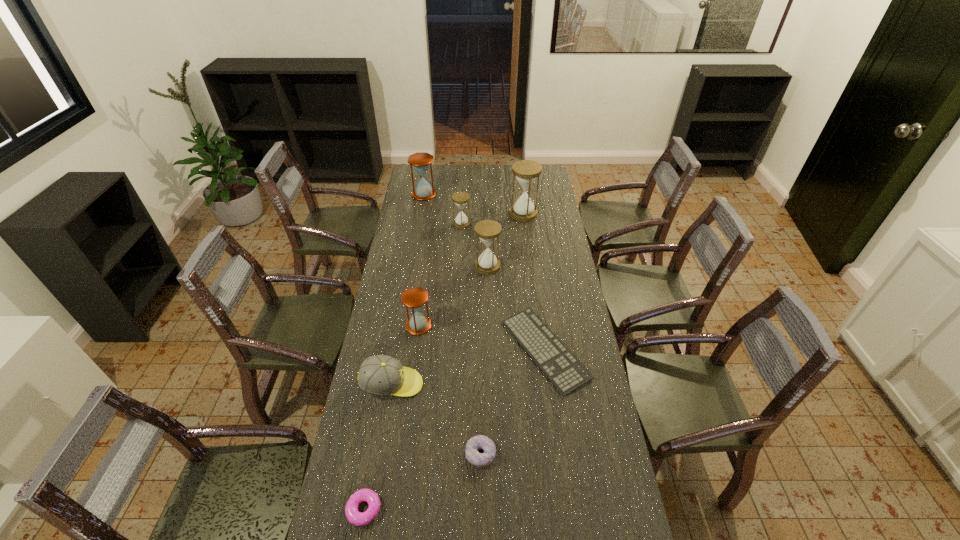
The image size is (960, 540). I want to click on vacant point located between the brown doughnut and the computer keyboard, so click(513, 402).

Where is `empty space that is in between the nearest hourglass and the second white hourglass from left to right`? This screenshot has width=960, height=540. empty space that is in between the nearest hourglass and the second white hourglass from left to right is located at coordinates (453, 296).

Where is `free space between the left doughnut and the smallest white hourglass`? The image size is (960, 540). free space between the left doughnut and the smallest white hourglass is located at coordinates [413, 367].

Locate an element on the screen. Image resolution: width=960 pixels, height=540 pixels. the third closest object to the tallest object is located at coordinates (423, 191).

Identify which object is located as the nearest to the third hourglass from right to left. Please provide its 2D coordinates. Your answer should be formatted as a tuple, i.e. [(x, y)], where the tuple contains the x and y coordinates of a point satisfying the conditions above.

[(423, 191)]

At what (x,y) coordinates should I click in order to perform the action: click on hourglass that stands as the closest to the farthest object. Please return your answer as a coordinate pair (x, y). This screenshot has width=960, height=540. Looking at the image, I should click on pos(461,221).

You are a GUI agent. You are given a task and a screenshot of the screen. Output one action in this format:
    pyautogui.click(x=<x>, y=<y>)
    Task: Click on the second closest hourglass relative to the third hourglass from left to right
    
    Given the screenshot: What is the action you would take?
    pyautogui.click(x=526, y=171)

Select which white hourglass appears as the second closest to the taller doughnut. Please provide its 2D coordinates. Your answer should be formatted as a tuple, i.e. [(x, y)], where the tuple contains the x and y coordinates of a point satisfying the conditions above.

[(461, 221)]

The image size is (960, 540). I want to click on white hourglass identified as the second closest to the shortest object, so click(x=461, y=221).

Identify the location of free space that satisfies the following two spatial constraints: 1. on the back side of the nearer doughnut; 2. on the right side of the nearer brown hourglass. (397, 326).